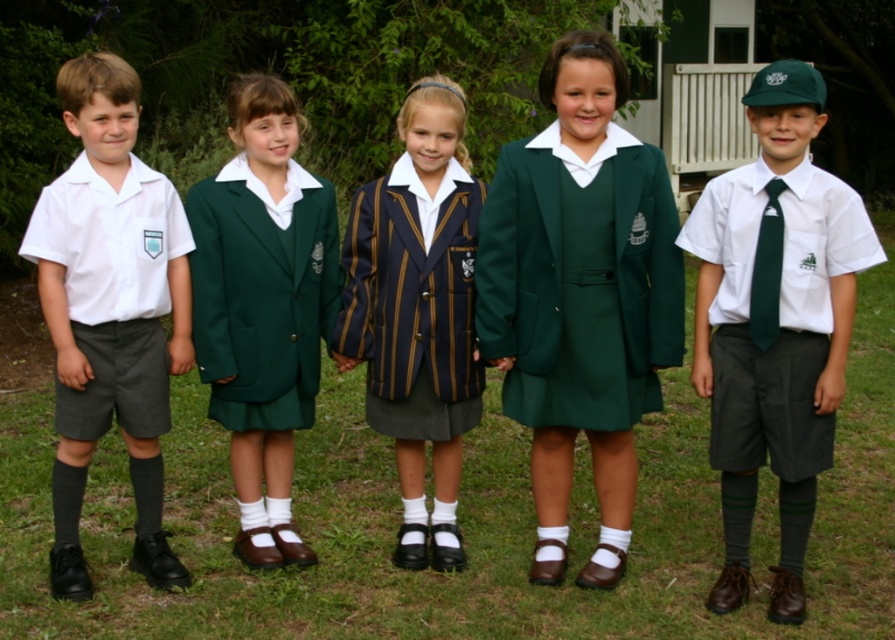
Question: Which point appears closest to the camera in this image?

Choices:
 (A) (10, 436)
 (B) (109, 182)
 (C) (763, 236)

Answer: (C)

Question: Which point appears farthest from the camera in this image?

Choices:
 (A) (367, 390)
 (B) (256, 449)

Answer: (A)

Question: Does striped wool blazer at center appear over green satin tie at right?

Choices:
 (A) no
 (B) yes

Answer: (A)

Question: Which of the following is the farthest from the observer?

Choices:
 (A) green fabric blazer at center
 (B) matte green tie at right
 (C) green satin tie at right
 (D) green grass at center

Answer: (D)

Question: Is matte green tie at right thinner than striped wool blazer at center?

Choices:
 (A) yes
 (B) no

Answer: (B)

Question: Is green fabric blazer at center wider than green satin tie at right?

Choices:
 (A) yes
 (B) no

Answer: (A)